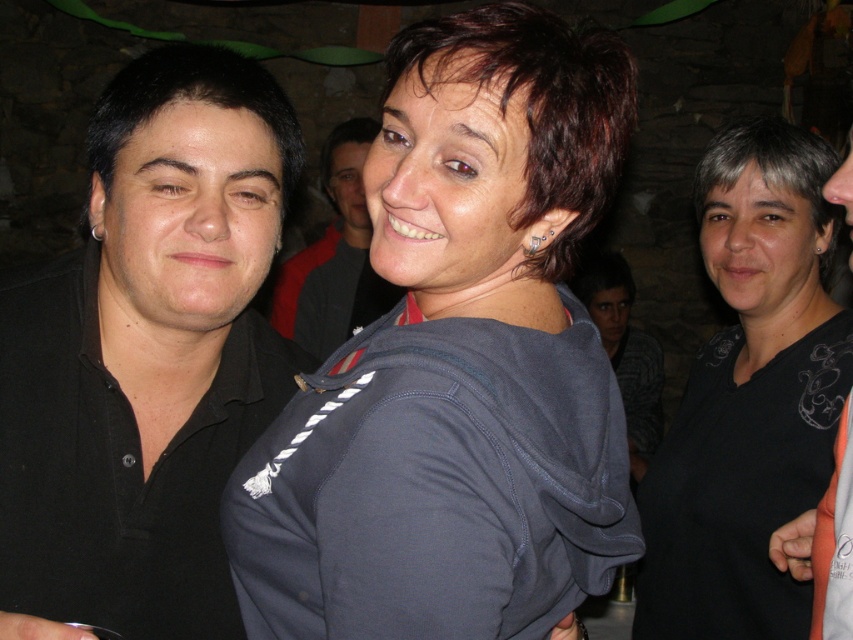
Question: Is matte black shirt at upper left closer to the viewer compared to gray striped sweater at center?

Choices:
 (A) yes
 (B) no

Answer: (A)

Question: Is black matte shirt at left to the right of black matte shirt at center from the viewer's perspective?

Choices:
 (A) yes
 (B) no

Answer: (B)

Question: Which of the following is the closest to the observer?

Choices:
 (A) (819, 314)
 (B) (625, 381)
 (C) (378, 356)

Answer: (C)

Question: Which point is farther to the camera?

Choices:
 (A) click(653, 358)
 (B) click(109, 128)

Answer: (A)

Question: Can you confirm if matte black shirt at upper left is positioned below gray striped sweater at center?

Choices:
 (A) yes
 (B) no

Answer: (B)

Question: Which of the following is the closest to the observer?

Choices:
 (A) (288, 481)
 (B) (631, 436)

Answer: (A)